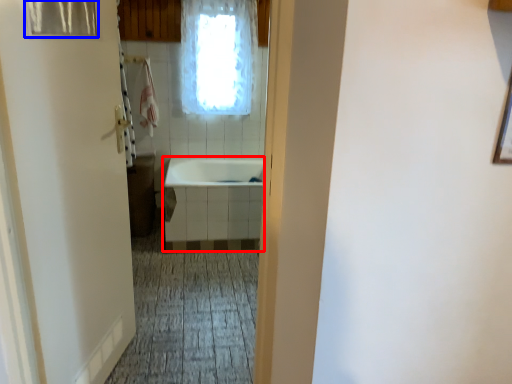
Question: Among these objects, which one is farthest to the camera, bath (highlighted by a red box) or shower curtain (highlighted by a blue box)?

Choices:
 (A) bath
 (B) shower curtain

Answer: (A)